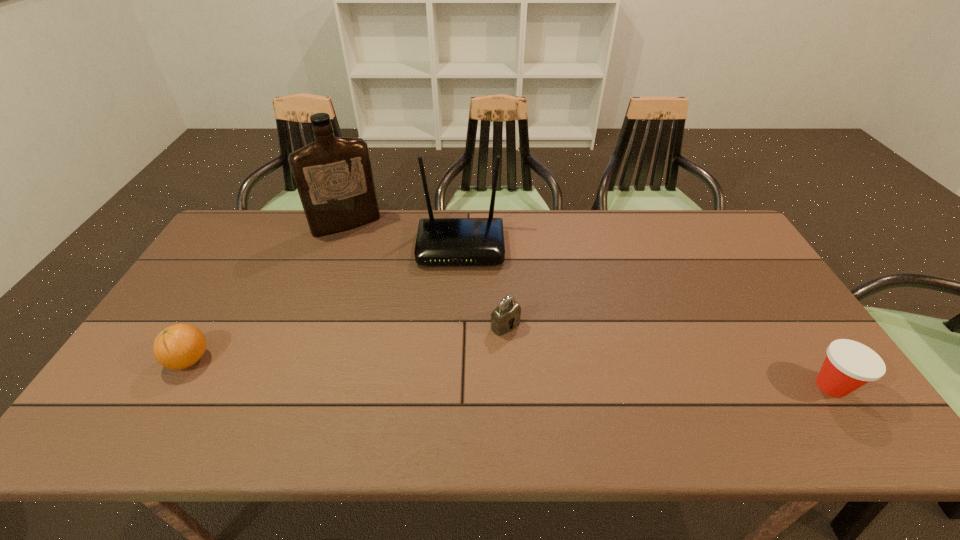
This screenshot has width=960, height=540. In order to click on free spot on the desktop that is between the orange and the Dixie cup and is positioned on the front-facing side of the second tallest object in this screenshot , I will do `click(457, 370)`.

In order to click on free spot on the desktop that is between the orange and the rightmost object and is positioned at the front of the padlock near the keyhole in this screenshot , I will do `click(559, 375)`.

Locate an element on the screen. This screenshot has width=960, height=540. free space on the desktop that is between the orange and the Dixie cup and is positioned on the label side of the liquor is located at coordinates (423, 369).